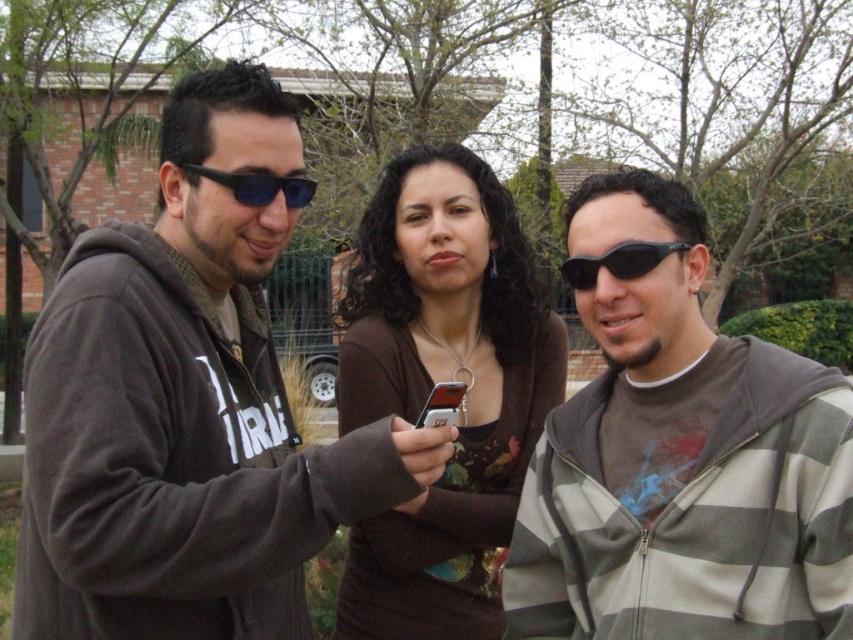
Question: Observing the image, what is the correct spatial positioning of striped hoodie at center in reference to matte brown sweater at center?

Choices:
 (A) right
 (B) left

Answer: (A)

Question: Is striped hoodie at center below silver metallic smartphone at center?

Choices:
 (A) no
 (B) yes

Answer: (B)

Question: Which of these objects is positioned farthest from the matte black sunglasses at left?

Choices:
 (A) black plastic sunglasses at center
 (B) silver metallic smartphone at center
 (C) dark gray hoodie at center

Answer: (A)

Question: Is dark gray hoodie at center bigger than matte brown sweater at center?

Choices:
 (A) yes
 (B) no

Answer: (A)

Question: Which of the following is the closest to the observer?

Choices:
 (A) (218, 172)
 (B) (738, 417)

Answer: (A)

Question: Which is farther from the silver metallic smartphone at center?

Choices:
 (A) dark gray hoodie at center
 (B) black plastic sunglasses at center
 (C) matte brown sweater at center

Answer: (C)